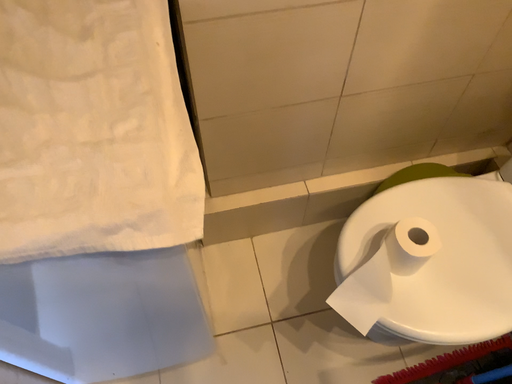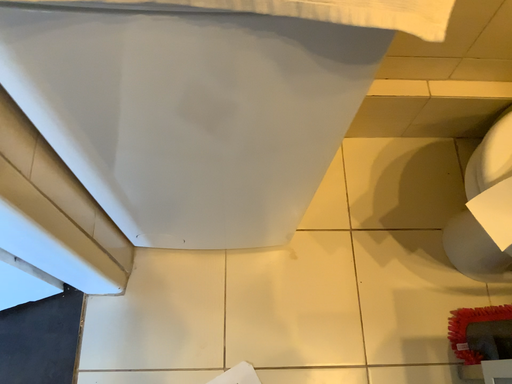
Question: Which way did the camera rotate in the video?

Choices:
 (A) rotated upward
 (B) rotated downward

Answer: (B)